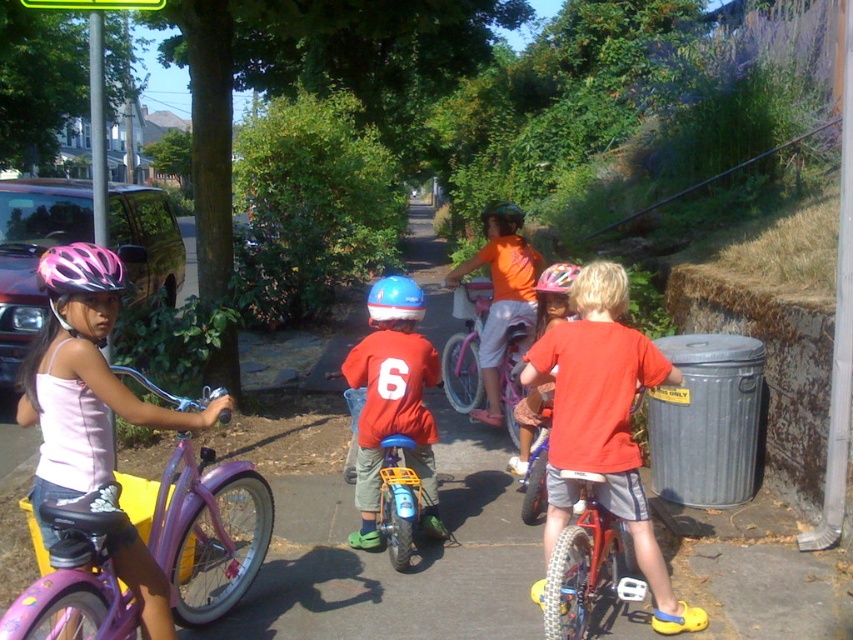
Question: Considering the relative positions of pink matte bicycle helmet at left and matte blue helmet at center in the image provided, where is pink matte bicycle helmet at left located with respect to matte blue helmet at center?

Choices:
 (A) above
 (B) below

Answer: (B)

Question: Can you confirm if pink matte bicycle helmet at left is positioned to the right of blue matte helmet at center?

Choices:
 (A) yes
 (B) no

Answer: (B)

Question: Which of these objects is positioned closest to the matte red bicycle at center?

Choices:
 (A) paved asphalt at center
 (B) pink matte bicycle helmet at left

Answer: (A)

Question: Is pink matte helmet at upper left wider than blue matte helmet at center?

Choices:
 (A) no
 (B) yes

Answer: (A)

Question: Among these points, which one is farthest from the camera?

Choices:
 (A) (42, 275)
 (B) (426, 340)
 (C) (306, 445)
 (D) (556, 291)

Answer: (C)

Question: Which point is closer to the camera taking this photo?

Choices:
 (A) (474, 497)
 (B) (564, 262)
 (C) (703, 621)
 (D) (491, 378)

Answer: (C)